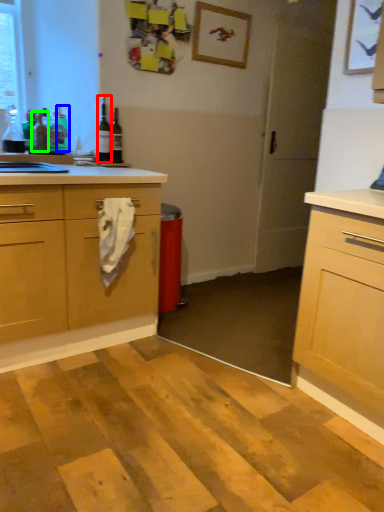
Question: Which is nearer to the bottle (highlighted by a red box)? bottle (highlighted by a blue box) or bottle (highlighted by a green box).

Choices:
 (A) bottle
 (B) bottle

Answer: (A)